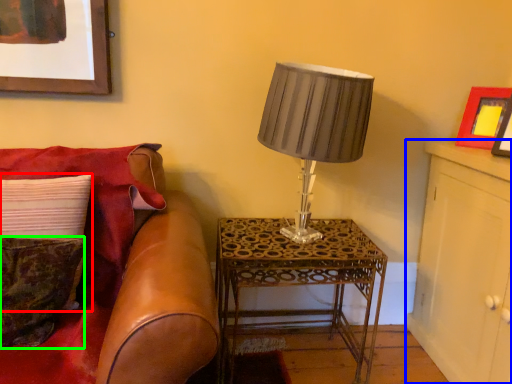
Question: Estimate the real-world distances between objects in this image. Which object is farther from pillow (highlighted by a red box), dresser (highlighted by a blue box) or pillow (highlighted by a green box)?

Choices:
 (A) dresser
 (B) pillow

Answer: (A)